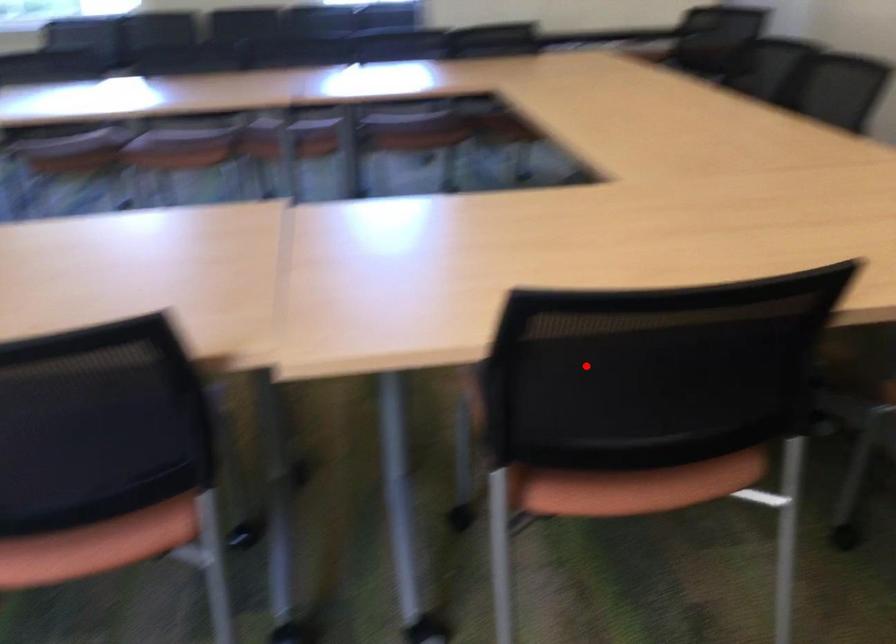
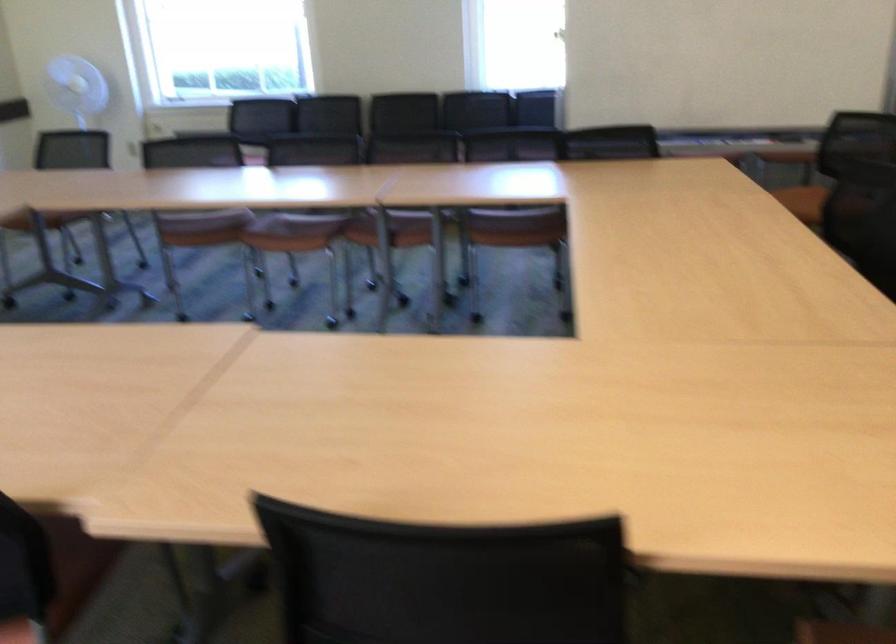
Where in the second image is the point corresponding to the highlighted location from the first image?

(444, 579)